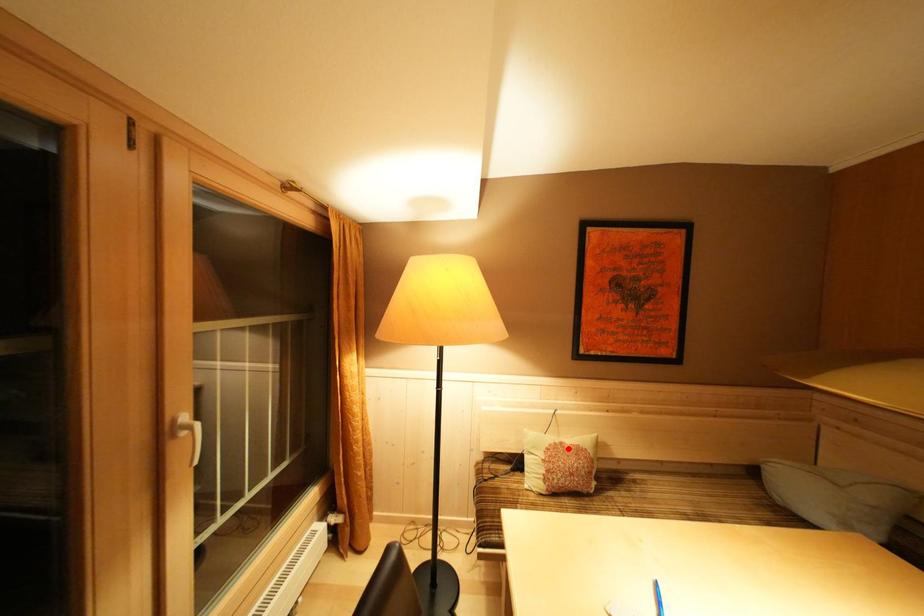
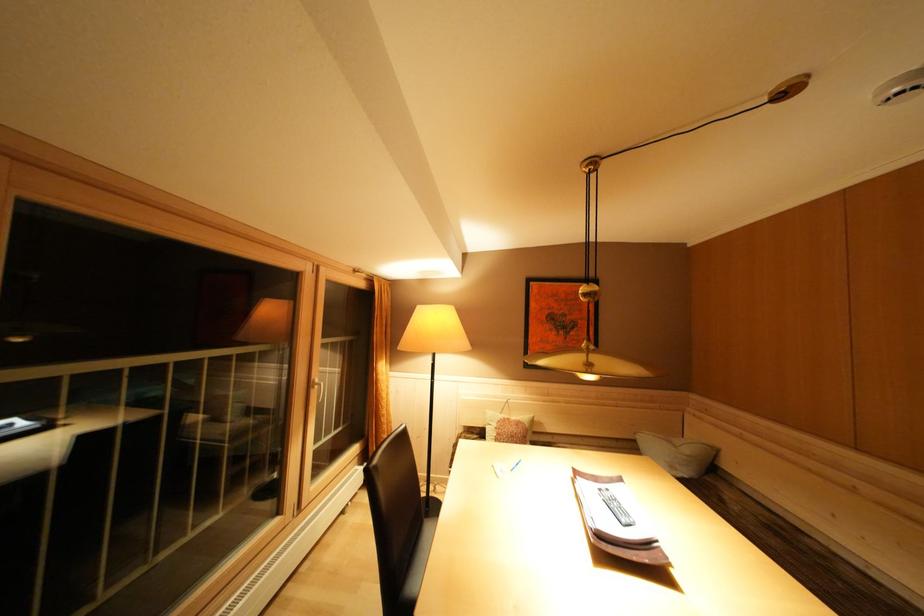
Locate, in the second image, the point that corresponds to the highlighted location in the first image.

(515, 424)